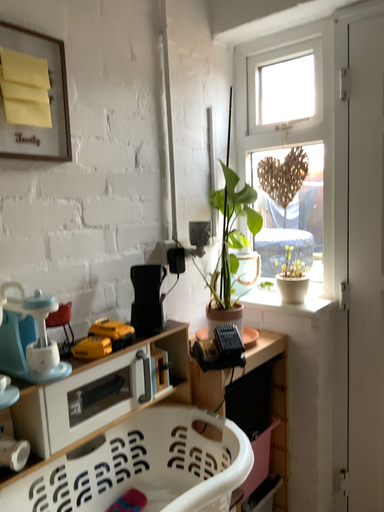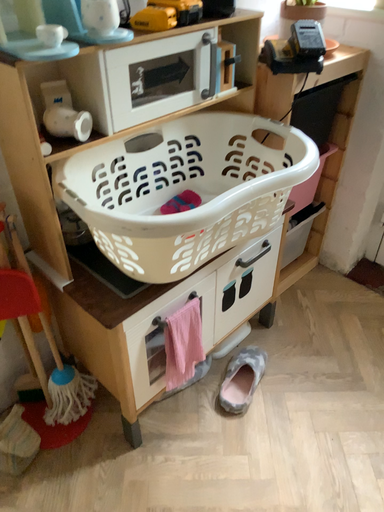
Question: Which way did the camera rotate in the video?

Choices:
 (A) rotated upward
 (B) rotated downward

Answer: (B)